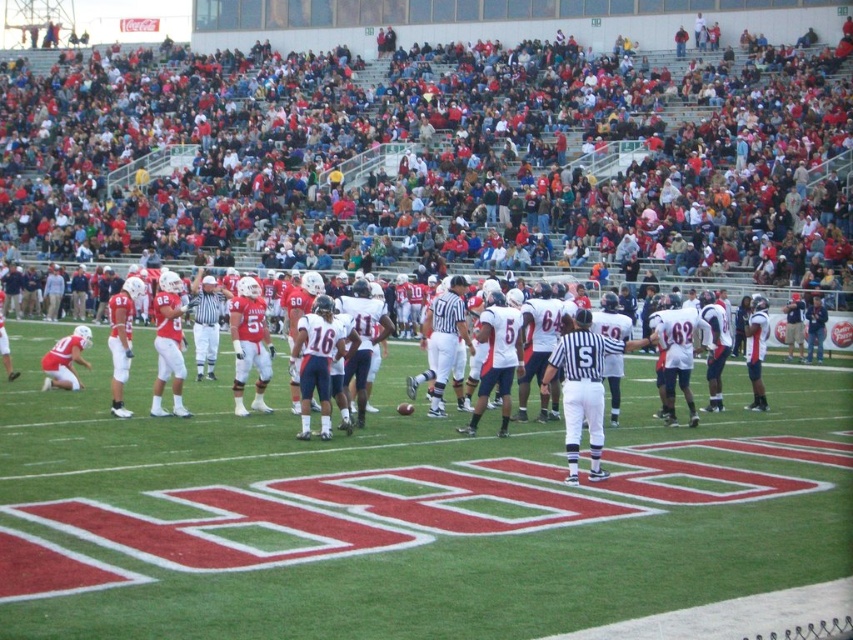
Question: Which object appears closest to the camera in this image?

Choices:
 (A) white uniformed players at center
 (B) red fabric crowd at upper center
 (C) white uniform at center

Answer: (A)

Question: Based on their relative distances, which object is nearer to the white striped referee at center?

Choices:
 (A) red fabric crowd at upper center
 (B) white uniformed man at center
 (C) white uniformed players at center
 (D) white uniform at center

Answer: (D)

Question: Is the position of white uniform at center less distant than that of white uniformed players at center?

Choices:
 (A) no
 (B) yes

Answer: (A)

Question: Which point is farther to the camera?

Choices:
 (A) (3, 192)
 (B) (575, 397)
 (C) (451, 307)
 (D) (583, 305)

Answer: (A)

Question: From the image, what is the correct spatial relationship of green grass football field at center in relation to white uniformed players at center?

Choices:
 (A) below
 (B) above

Answer: (A)

Question: Can you confirm if red fabric crowd at upper center is bigger than white striped referee at center?

Choices:
 (A) no
 (B) yes

Answer: (B)